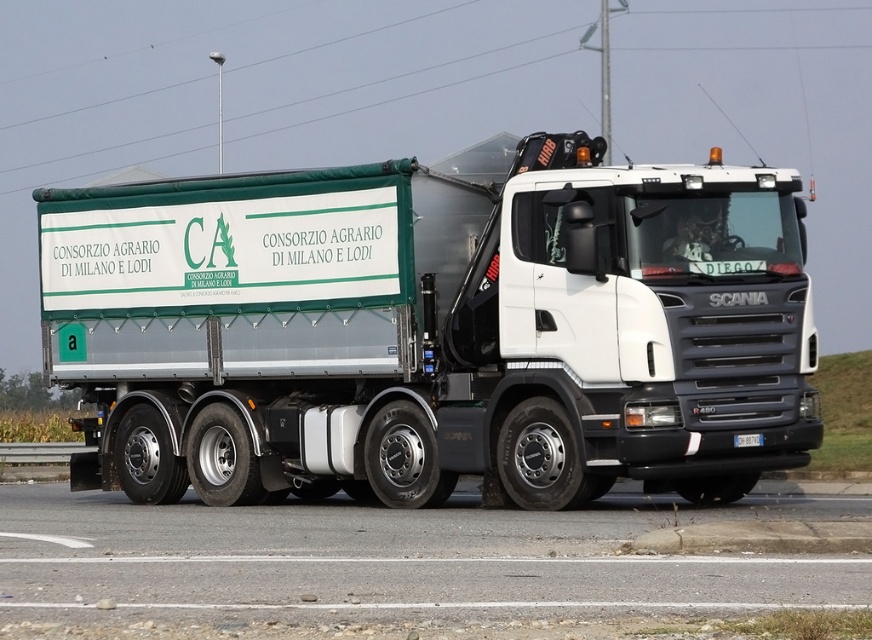
You are a traffic officer observing a white metallic trailer truck at center and a gray asphalt road at lower center. Which object is positioned to the right side of the other?

The gray asphalt road at lower center is positioned to the right side of the white metallic trailer truck at center because the truck is to the left of the road.

You are a traffic officer observing the scene. You need to determine if the white metallic trailer truck at center is on the gray asphalt road at lower center. Based on the scene description, can you confirm this?

The white metallic trailer truck at center is located above gray asphalt road at lower center, which means it is indeed on the road.

You are a traffic controller monitoring the highway. You notice a white metallic trailer truck at center. Based on its position coordinates, can you determine if it is positioned exactly at the center of the road?

The white metallic trailer truck at center is located at point coordinates of (x=436, y=328). Since the coordinates are very close to 0.5, it is positioned nearly at the center of the road.